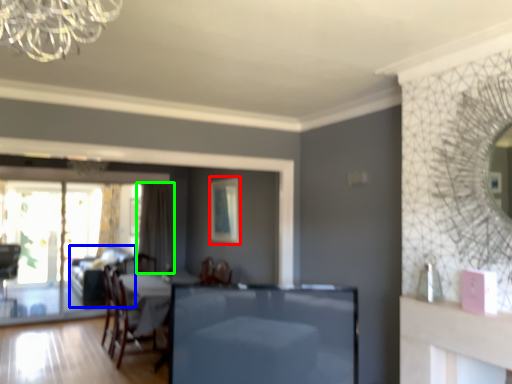
Question: Which object is positioned farthest from picture frame (highlighted by a red box)? Select from couch (highlighted by a blue box) and curtain (highlighted by a green box).

Choices:
 (A) couch
 (B) curtain

Answer: (A)